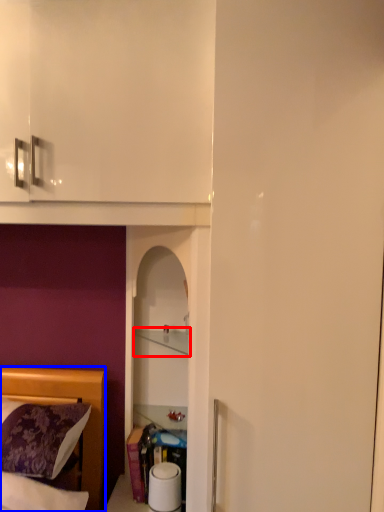
Question: Which object appears closest to the camera in this image, cabinet (highlighted by a red box) or bed (highlighted by a blue box)?

Choices:
 (A) cabinet
 (B) bed

Answer: (B)